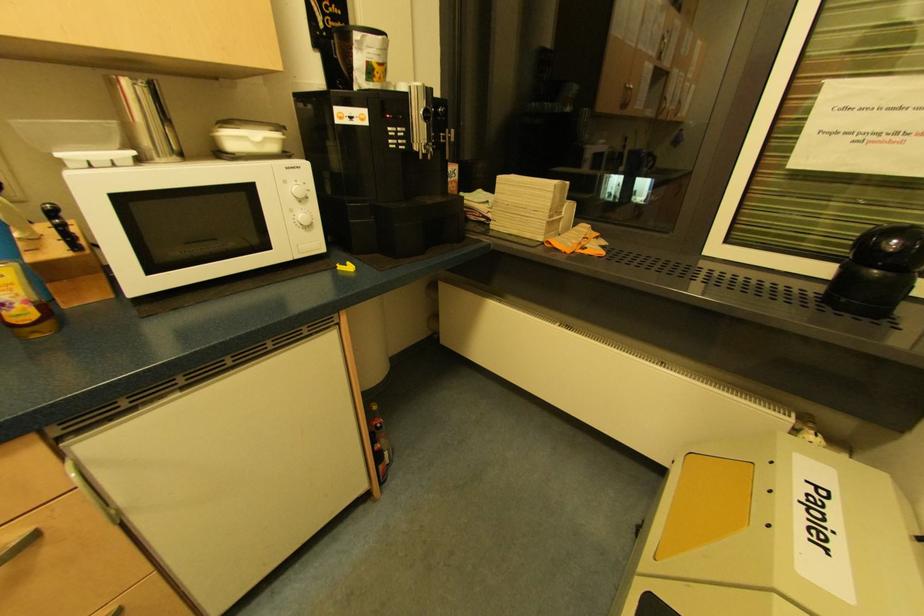
Which object does [359,55] point to?

It corresponds to the coffee bean bag in the image.